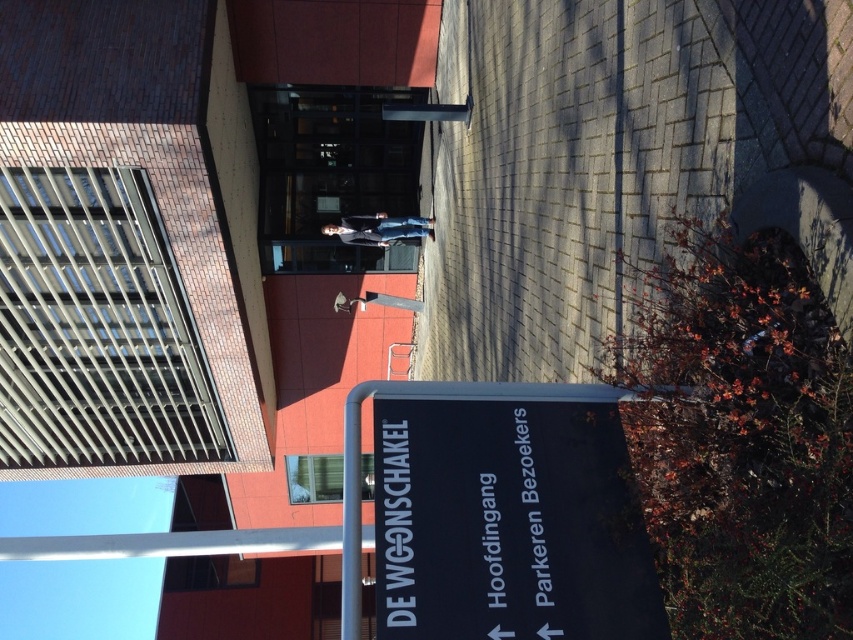
Between point (433, 476) and point (426, 228), which one is positioned behind?

Positioned behind is point (426, 228).

Can you confirm if black plastic sign at center is positioned to the right of light blue jeans at center?

Indeed, black plastic sign at center is positioned on the right side of light blue jeans at center.

The width and height of the screenshot is (853, 640). What do you see at coordinates (508, 524) in the screenshot?
I see `black plastic sign at center` at bounding box center [508, 524].

Where is `black plastic sign at center`? This screenshot has width=853, height=640. black plastic sign at center is located at coordinates (508, 524).

Does black plastic sign at center come behind metallic gray pole at center?

No, black plastic sign at center is in front of metallic gray pole at center.

From the picture: Can you confirm if black plastic sign at center is positioned below metallic gray pole at center?

Actually, black plastic sign at center is above metallic gray pole at center.

Which is in front, point (560, 416) or point (343, 452)?

Point (560, 416) is more forward.

I want to click on black plastic sign at center, so click(508, 524).

In the scene shown: Is the position of metallic gray pole at center more distant than that of light blue jeans at center?

No.

Is metallic gray pole at center to the right of light blue jeans at center from the viewer's perspective?

Correct, you'll find metallic gray pole at center to the right of light blue jeans at center.

What do you see at coordinates (352, 509) in the screenshot? This screenshot has width=853, height=640. I see `metallic gray pole at center` at bounding box center [352, 509].

Locate an element on the screen. metallic gray pole at center is located at coordinates (352, 509).